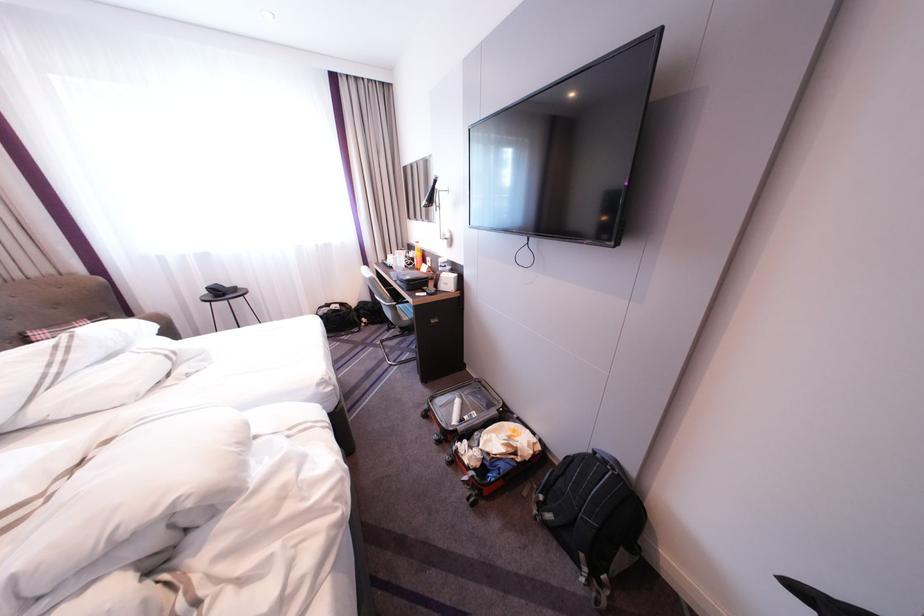
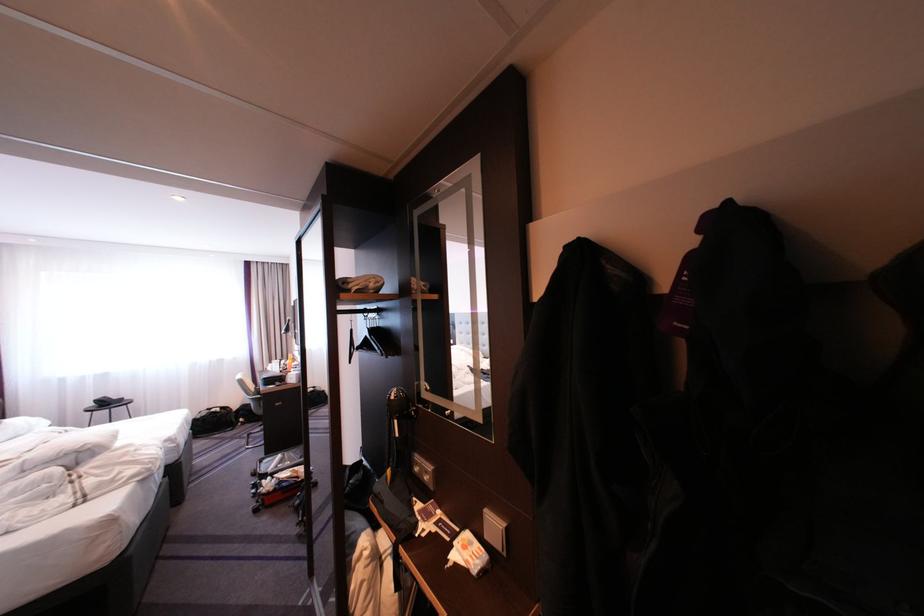
Find the pixel in the second image that matches (396,301) in the first image.

(261, 395)